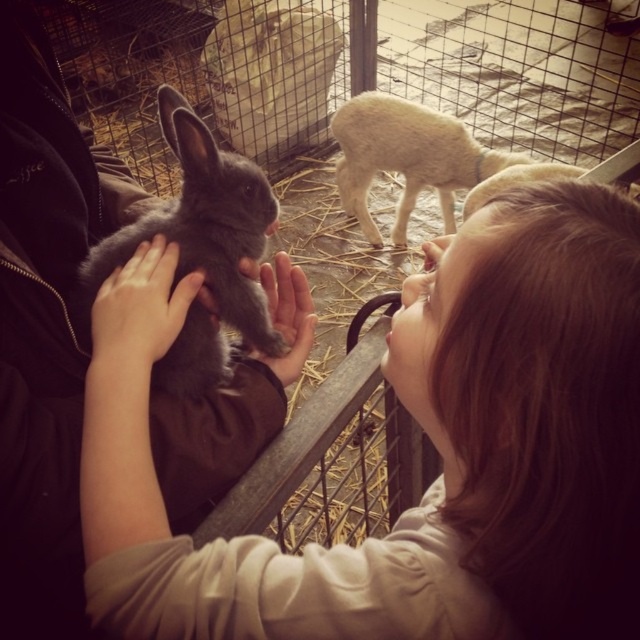
Question: Which is farther from the fluffy white lamb at upper center?

Choices:
 (A) smooth gray rabbit at center
 (B) gray soft fur rabbit at center

Answer: (A)

Question: Considering the real-world distances, which object is farthest from the matte gray rabbit at center?

Choices:
 (A) fluffy white lamb at upper center
 (B) smooth gray rabbit at center
 (C) smooth skin hand at center

Answer: (A)

Question: Does gray soft fur rabbit at center appear under matte gray rabbit at center?

Choices:
 (A) no
 (B) yes

Answer: (A)

Question: Which point is farther to the camera?

Choices:
 (A) (244, 273)
 (B) (141, 356)

Answer: (A)

Question: Is gray soft fur rabbit at center behind fluffy white lamb at upper center?

Choices:
 (A) yes
 (B) no

Answer: (B)

Question: Does gray soft fur rabbit at center have a greater width compared to smooth skin hand at center?

Choices:
 (A) no
 (B) yes

Answer: (B)